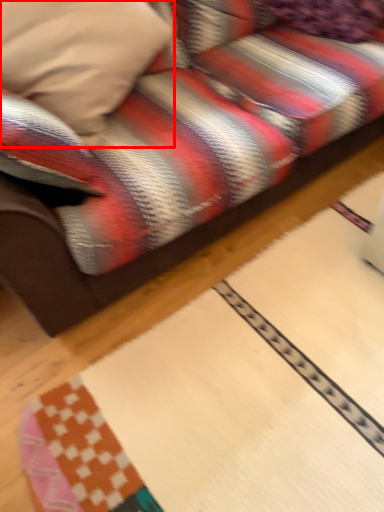
Question: From the image's perspective, where is pillow (annotated by the red box) located in relation to pillow in the image?

Choices:
 (A) above
 (B) below

Answer: (B)